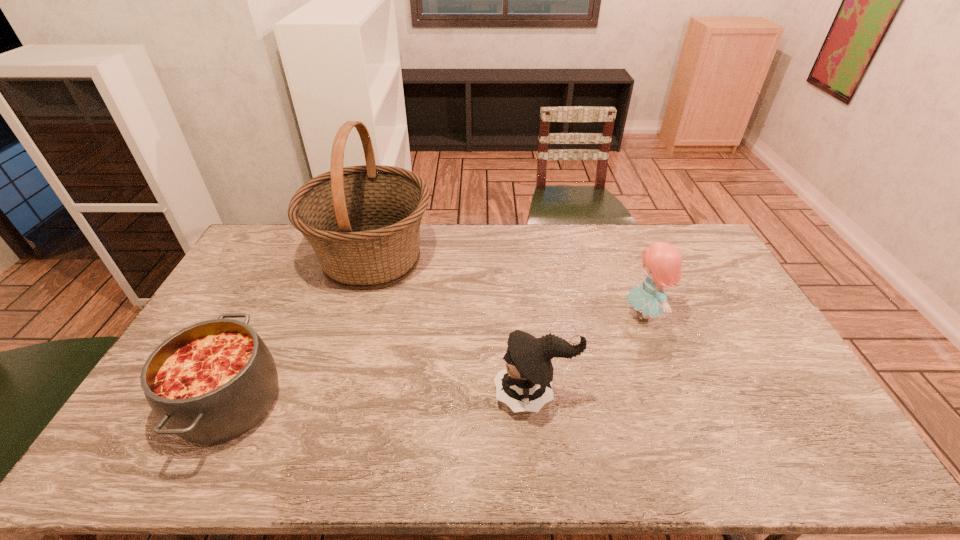
Locate an element on the screen. The width and height of the screenshot is (960, 540). free space between the second shortest object and the tallest object is located at coordinates (453, 327).

This screenshot has width=960, height=540. What are the coordinates of `vacant area that lies between the right doll and the left doll` in the screenshot? It's located at (589, 355).

Locate an element on the screen. This screenshot has width=960, height=540. free point between the second object from right to left and the casserole is located at coordinates (382, 399).

This screenshot has height=540, width=960. I want to click on the closest object relative to the tallest object, so click(x=213, y=381).

Locate which object is the closest to the tallest object. Please provide its 2D coordinates. Your answer should be formatted as a tuple, i.e. [(x, y)], where the tuple contains the x and y coordinates of a point satisfying the conditions above.

[(213, 381)]

Find the location of a particular element. blank area in the image that satisfies the following two spatial constraints: 1. at the face of the third tallest object; 2. on the front side of the shortest object is located at coordinates (536, 402).

Find the location of a particular element. vacant point that satisfies the following two spatial constraints: 1. at the face of the second object from right to left; 2. on the front side of the casserole is located at coordinates (536, 402).